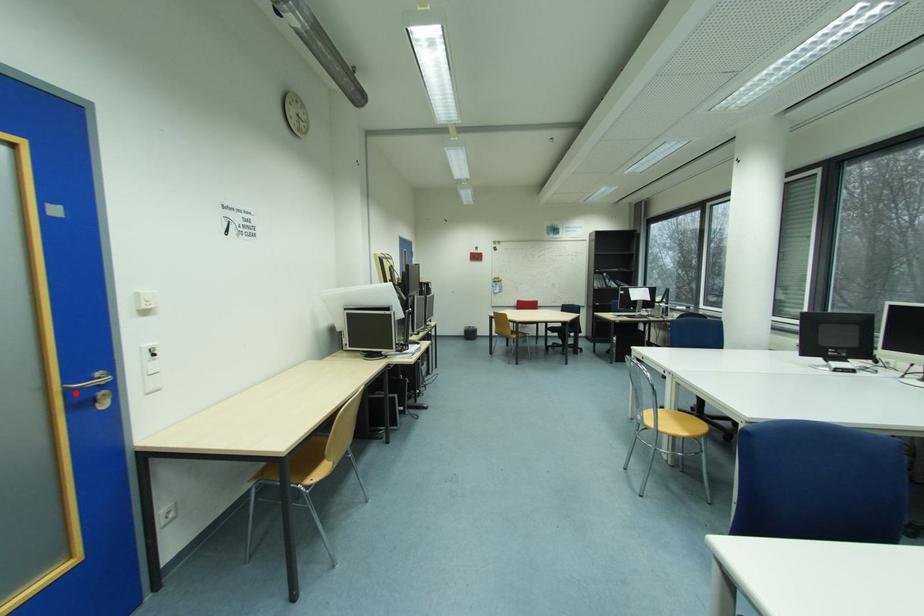
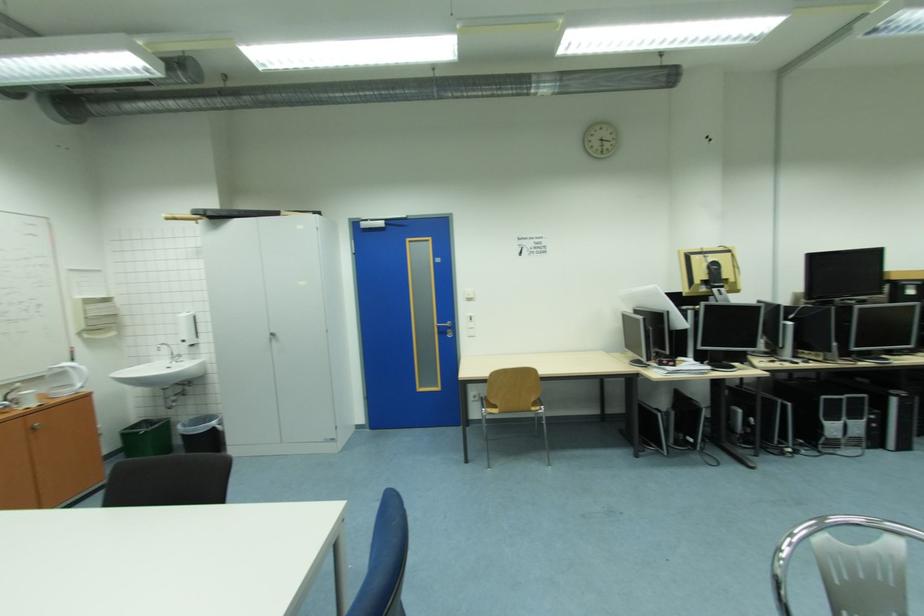
Find the pixel in the second image that matches the highlighted location in the first image.

(445, 328)